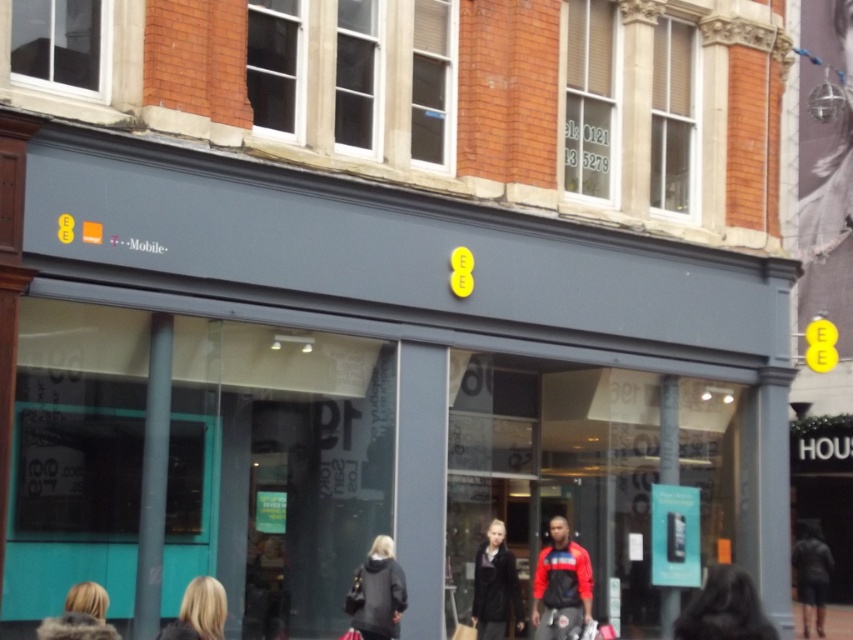
You are a customer entering the EE Mobile store and see the dark gray coat at lower center and the blonde fur coat at lower left. Which coat is closer to the entrance?

The dark gray coat at lower center is closer to the entrance because the blonde fur coat at lower left is behind it.

You are standing in front of the EE Mobile store and notice two points on the glass reflection. The first point is at coordinate point(515, 570) and the second is at point(805, 637). Which point appears closer to you?

Point(515, 570) is closer to the camera than point(805, 637), so the first point appears closer to you.